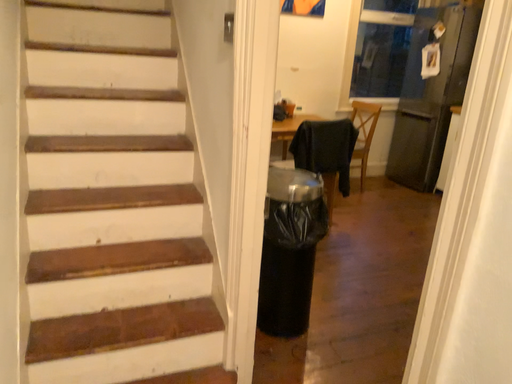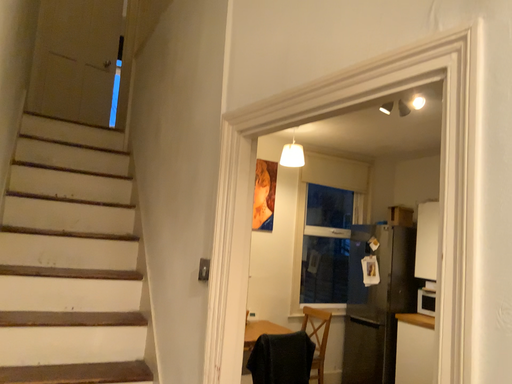
Question: Which way did the camera rotate in the video?

Choices:
 (A) rotated upward
 (B) rotated downward

Answer: (A)